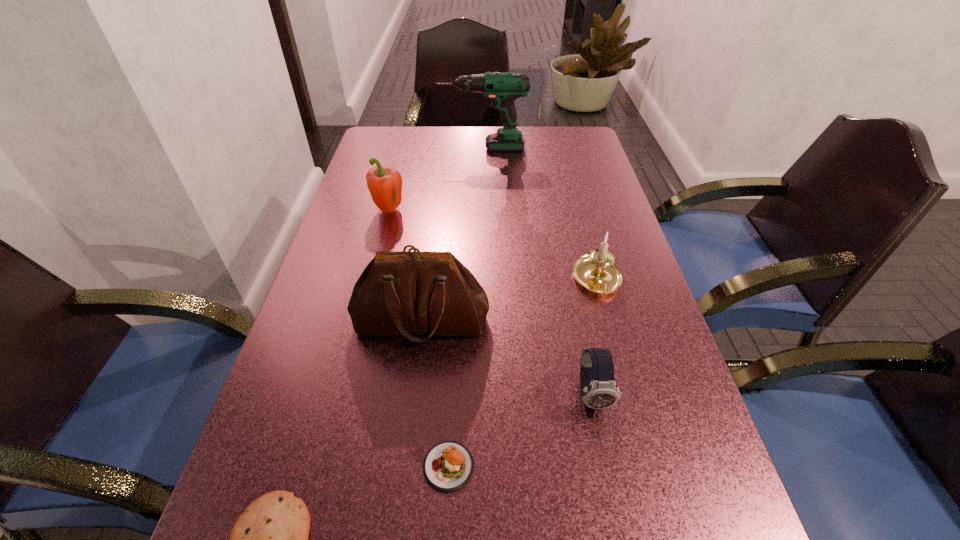
This screenshot has width=960, height=540. Find the location of `object identified as the fourth closest to the sixth tallest object`. object identified as the fourth closest to the sixth tallest object is located at coordinates (597, 272).

Identify which object is located as the third nearest to the cookie. Please provide its 2D coordinates. Your answer should be formatted as a tuple, i.e. [(x, y)], where the tuple contains the x and y coordinates of a point satisfying the conditions above.

[(598, 389)]